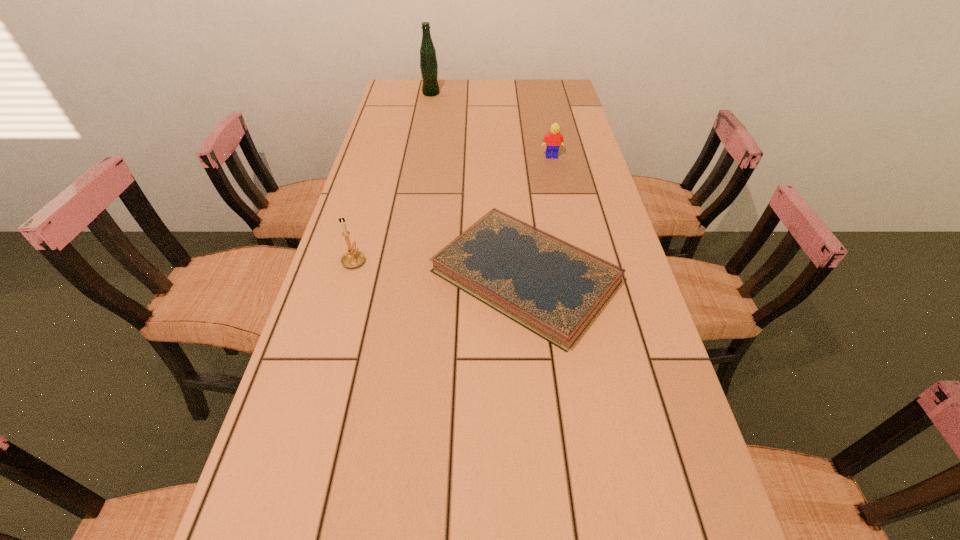
Find the location of a particular element. This screenshot has width=960, height=540. vacant space situated on the handle side of the third shortest object is located at coordinates (371, 202).

Locate an element on the screen. This screenshot has width=960, height=540. vacant space located 0.350m on the front-facing side of the Lego is located at coordinates (567, 228).

At what (x,y) coordinates should I click in order to perform the action: click on vacant space situated 0.310m on the front of the shortest object. Please return your answer as a coordinate pair (x, y). The height and width of the screenshot is (540, 960). Looking at the image, I should click on (549, 519).

The height and width of the screenshot is (540, 960). In order to click on object positioned at the far edge in this screenshot , I will do `click(428, 60)`.

I want to click on beer bottle present at the left edge, so click(x=428, y=60).

Identify the location of candle holder situated at the left edge. Image resolution: width=960 pixels, height=540 pixels. (353, 258).

I want to click on Lego that is at the right edge, so click(x=553, y=140).

Find the location of `paperback book located in the right edge section of the desktop`. paperback book located in the right edge section of the desktop is located at coordinates (554, 289).

Find the location of a particular element. object that is at the far left corner is located at coordinates (428, 60).

You are a GUI agent. You are given a task and a screenshot of the screen. Output one action in this format:
    pyautogui.click(x=<x>, y=<y>)
    Task: Click on the vacant space at the far edge
    Image resolution: width=960 pixels, height=540 pixels.
    Given the screenshot: What is the action you would take?
    pyautogui.click(x=479, y=92)